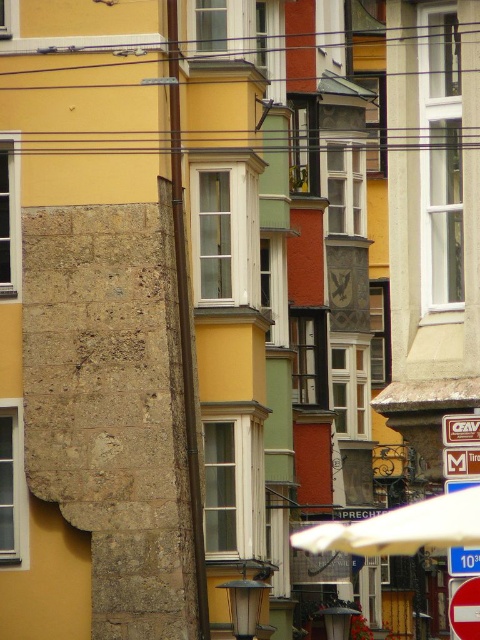
Question: Is metallic rectangular sign at center-right to the left of blue plastic sign at center from the viewer's perspective?

Choices:
 (A) no
 (B) yes

Answer: (A)

Question: Considering the real-world distances, which object is farthest from the blue plastic sign at center?

Choices:
 (A) metallic rectangular sign at center-right
 (B) white matte umbrella at center

Answer: (B)

Question: From the image, what is the correct spatial relationship of metallic rectangular sign at center in relation to metallic rectangular sign at center-right?

Choices:
 (A) above
 (B) below

Answer: (A)

Question: Can you confirm if metallic rectangular sign at center-right is positioned to the left of blue plastic sign at center?

Choices:
 (A) yes
 (B) no

Answer: (B)

Question: Which point is farther from the camera taking this photo?

Choices:
 (A) 467,422
 (B) 468,554

Answer: (A)

Question: Which point is closer to the camera taking this photo?

Choices:
 (A) (474, 429)
 (B) (477, 563)
 (C) (466, 451)
 (D) (434, 499)

Answer: (B)